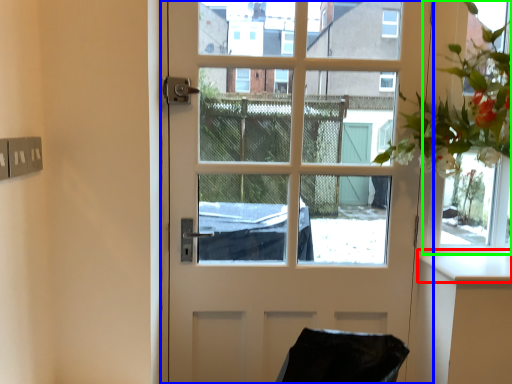
Question: Considering the real-world distances, which object is farthest from counter top (highlighted by a red box)? door (highlighted by a blue box) or window frame (highlighted by a green box)?

Choices:
 (A) door
 (B) window frame

Answer: (A)